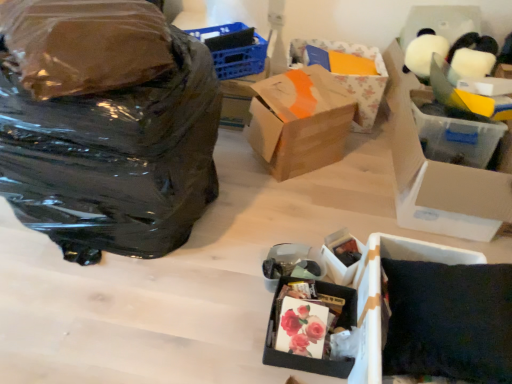
Where is `unoccupied region to the right of brown cardboard box at center, placed as the 4th box when sorted from bottom to top`? unoccupied region to the right of brown cardboard box at center, placed as the 4th box when sorted from bottom to top is located at coordinates (359, 166).